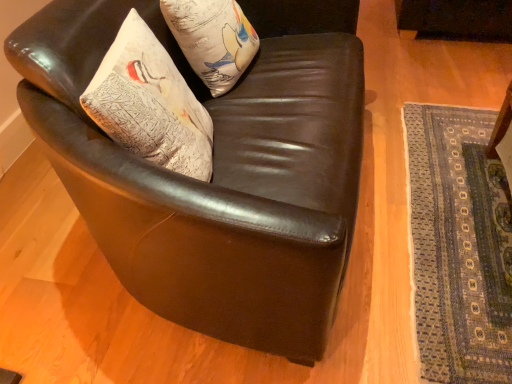
Question: From a real-world perspective, is shiny brown leather armchair at center positioned above or below textured white pillow at upper left?

Choices:
 (A) above
 (B) below

Answer: (B)

Question: Considering the positions of shiny brown leather armchair at center and textured white pillow at upper left in the image, is shiny brown leather armchair at center bigger or smaller than textured white pillow at upper left?

Choices:
 (A) small
 (B) big

Answer: (B)

Question: Considering the real-world distances, which object is closest to the shiny brown leather armchair at center?

Choices:
 (A) blue woven mat at lower right
 (B) textured white pillow at upper left
 (C) textured white pillow at upper left

Answer: (C)

Question: Which of these objects is positioned closest to the textured white pillow at upper left?

Choices:
 (A) blue woven mat at lower right
 (B) textured white pillow at upper left
 (C) shiny brown leather armchair at center

Answer: (B)